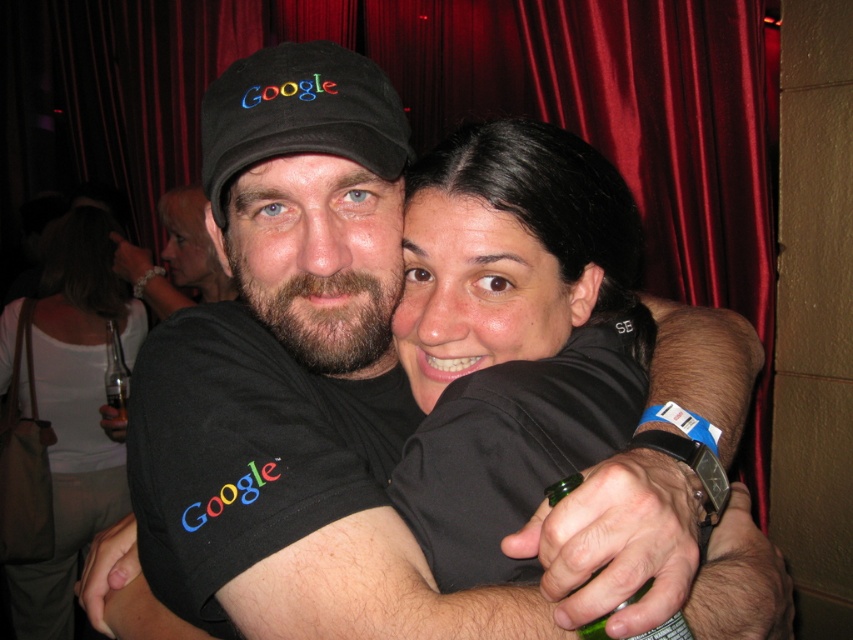
Question: Is white matte shirt at upper center to the left of matte black shirt at center from the viewer's perspective?

Choices:
 (A) no
 (B) yes

Answer: (B)

Question: Which point is closer to the camera?

Choices:
 (A) black fabric baseball cap at center
 (B) matte black shirt at center
 (C) white matte shirt at upper center

Answer: (A)

Question: Which of the following is the farthest from the observer?

Choices:
 (A) black fabric baseball cap at center
 (B) white matte shirt at upper center

Answer: (B)

Question: Does white matte shirt at upper center appear under black fabric baseball cap at center?

Choices:
 (A) yes
 (B) no

Answer: (A)

Question: Is white matte shirt at upper center to the left of black fabric baseball cap at center from the viewer's perspective?

Choices:
 (A) no
 (B) yes

Answer: (B)

Question: Which point is closer to the camera?

Choices:
 (A) (166, 218)
 (B) (247, 166)
 (C) (122, 323)

Answer: (B)